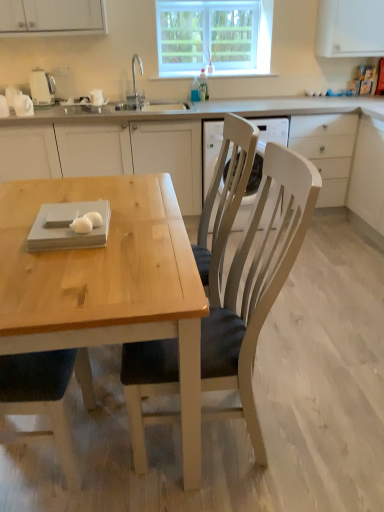
Question: Is white glossy egg at table, the second food in the front-to-back sequence, taller than white matte drawer at center right?

Choices:
 (A) yes
 (B) no

Answer: (B)

Question: Is white matte drawer at center right completely or partially inside white glossy egg at table, which is counted as the 1th food, starting from the back?

Choices:
 (A) no
 (B) yes

Answer: (A)

Question: Does white glossy egg at table, which is counted as the 1th food, starting from the back, appear on the right side of white matte drawer at center right?

Choices:
 (A) yes
 (B) no

Answer: (B)

Question: From a real-world perspective, is white glossy egg at table, the second food in the front-to-back sequence, located higher than white matte drawer at center right?

Choices:
 (A) no
 (B) yes

Answer: (B)

Question: Is white glossy egg at table, which is counted as the 1th food, starting from the back, not near white matte drawer at center right?

Choices:
 (A) yes
 (B) no

Answer: (A)

Question: Is white glossy egg at table, the second food in the front-to-back sequence, touching white matte drawer at center right?

Choices:
 (A) no
 (B) yes

Answer: (A)

Question: Are natural wood table at center and wooden chair at center located far from each other?

Choices:
 (A) no
 (B) yes

Answer: (B)

Question: Does natural wood table at center have a greater height compared to wooden chair at center?

Choices:
 (A) no
 (B) yes

Answer: (A)

Question: Can you confirm if natural wood table at center is wider than wooden chair at center?

Choices:
 (A) yes
 (B) no

Answer: (A)

Question: Is natural wood table at center completely or partially outside of wooden chair at center?

Choices:
 (A) yes
 (B) no

Answer: (A)

Question: Does natural wood table at center touch wooden chair at center?

Choices:
 (A) no
 (B) yes

Answer: (A)

Question: Is natural wood table at center further to the viewer compared to wooden chair at center?

Choices:
 (A) yes
 (B) no

Answer: (A)

Question: Can you confirm if clear glass window at upper center is smaller than wooden chair at center?

Choices:
 (A) no
 (B) yes

Answer: (B)